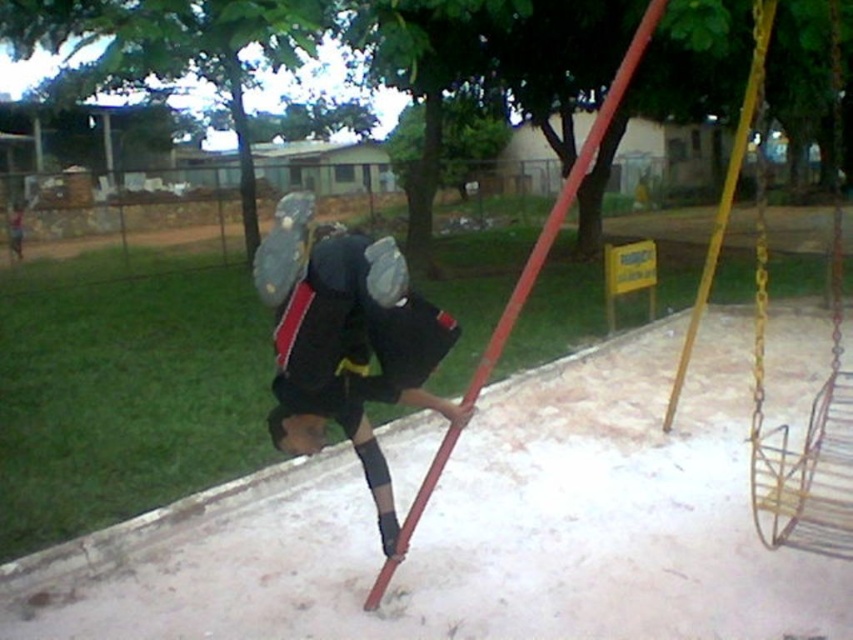
Question: Which point is farther to the camera?

Choices:
 (A) (810, 520)
 (B) (276, 355)

Answer: (B)

Question: Which point is farther to the camera?

Choices:
 (A) metallic chain swing at right
 (B) black matte uniform at center

Answer: (A)

Question: Among these points, which one is nearest to the camera?

Choices:
 (A) tap(828, 365)
 (B) tap(311, 252)

Answer: (B)

Question: Does black matte uniform at center have a greater width compared to metallic chain swing at right?

Choices:
 (A) yes
 (B) no

Answer: (B)

Question: Is black matte uniform at center below metallic chain swing at right?

Choices:
 (A) no
 (B) yes

Answer: (B)

Question: Can you confirm if black matte uniform at center is positioned below metallic chain swing at right?

Choices:
 (A) yes
 (B) no

Answer: (A)